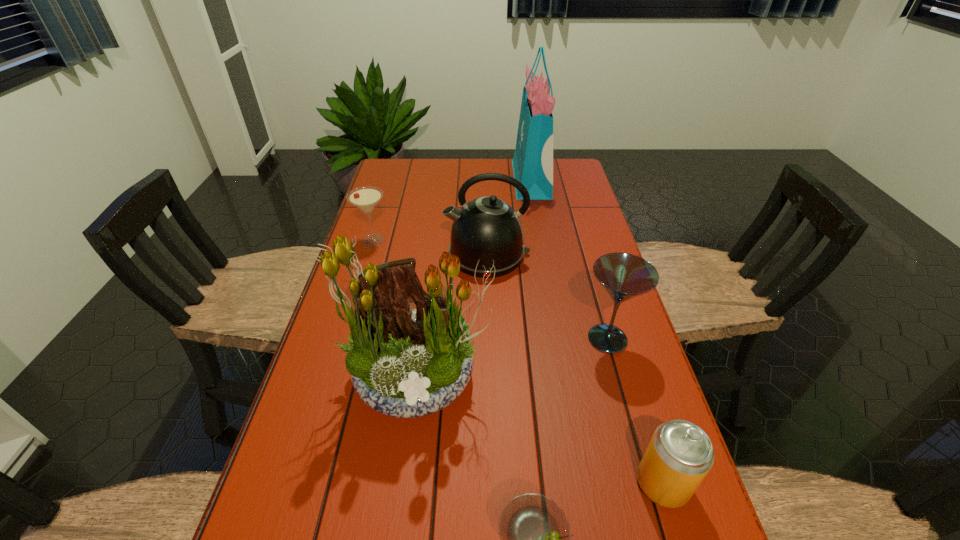
I want to click on martini situated at the right edge, so click(624, 276).

Where is `pop (soda) situated at the right edge`? pop (soda) situated at the right edge is located at coordinates (680, 454).

In order to click on object that is positioned at the far right corner in this screenshot , I will do point(532,163).

Locate an element on the screen. This screenshot has height=540, width=960. vacant region at the far edge of the desktop is located at coordinates (446, 176).

Locate an element on the screen. Image resolution: width=960 pixels, height=540 pixels. vacant space at the left edge of the desktop is located at coordinates (306, 468).

The height and width of the screenshot is (540, 960). In order to click on vacant region at the right edge of the desktop in this screenshot , I will do `click(576, 227)`.

Locate an element on the screen. vacant area that lies between the rightmost martini and the second nearest object is located at coordinates (635, 411).

Locate an element on the screen. The image size is (960, 540). vacant space that is in between the flower arrangement and the tallest martini is located at coordinates (513, 357).

Image resolution: width=960 pixels, height=540 pixels. What are the coordinates of `free area in between the farthest object and the flower arrangement` in the screenshot? It's located at (474, 278).

In order to click on unoccupied area between the flower arrangement and the rightmost martini in this screenshot , I will do `click(513, 357)`.